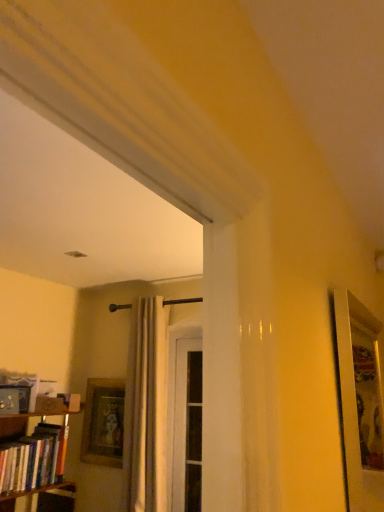
Question: Which is correct: hardcover books at left is inside wooden picture frame at lower left, or outside of it?

Choices:
 (A) inside
 (B) outside

Answer: (B)

Question: From a real-world perspective, is hardcover books at left physically located above or below wooden picture frame at lower left?

Choices:
 (A) above
 (B) below

Answer: (B)

Question: Estimate the real-world distances between objects in this image. Which object is farther from the white sheer curtain at center?

Choices:
 (A) hardcover books at left
 (B) white wood screen door at center
 (C) wooden picture frame at lower left

Answer: (A)

Question: Based on their relative distances, which object is farther from the hardcover books at left?

Choices:
 (A) wooden picture frame at lower left
 (B) white wood screen door at center
 (C) white sheer curtain at center

Answer: (B)